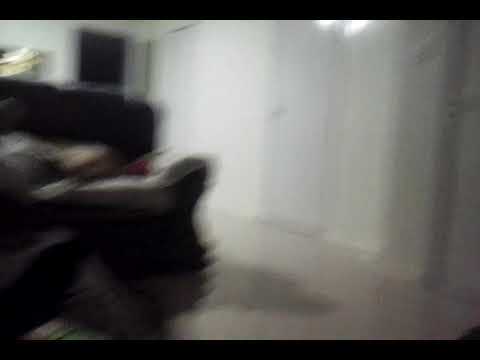
Image resolution: width=480 pixels, height=360 pixels. Find the location of `couch's armrest`. couch's armrest is located at coordinates (187, 164).